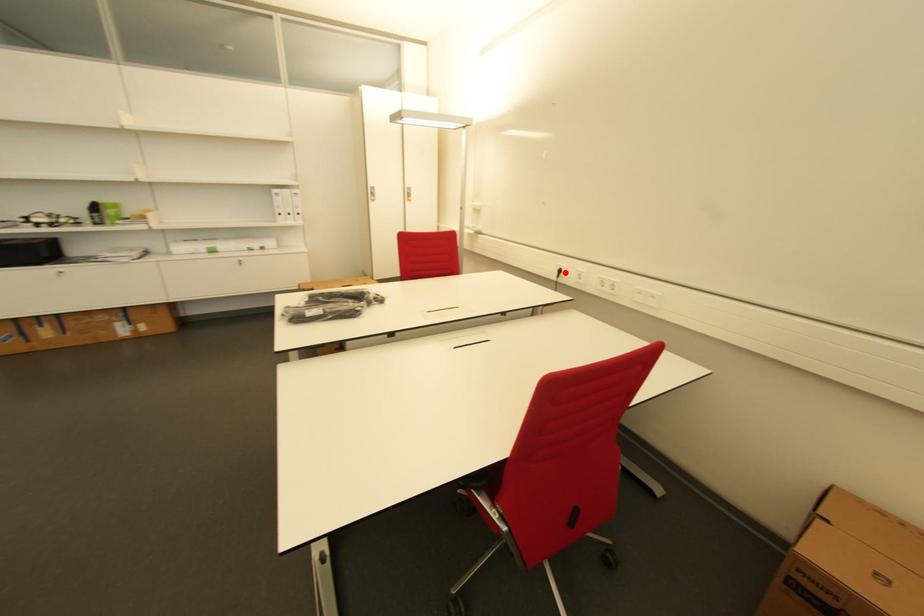
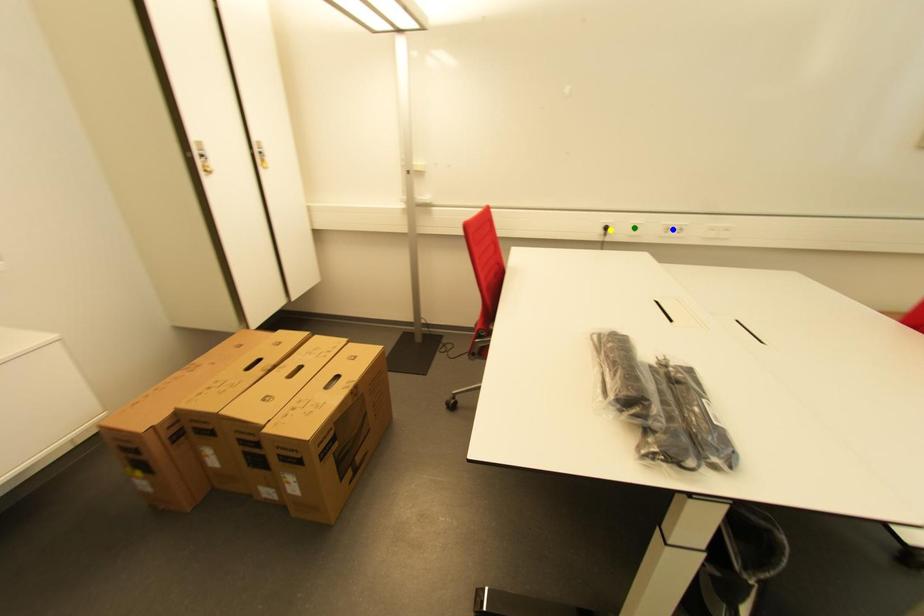
Question: I am providing you with two images of the same scene from different viewpoints. A red point is marked on the first image. You are given multiple points on the second image. Which point in image 2 represents the same 3d spot as the red point in image 1?

Choices:
 (A) green point
 (B) yellow point
 (C) blue point

Answer: (B)